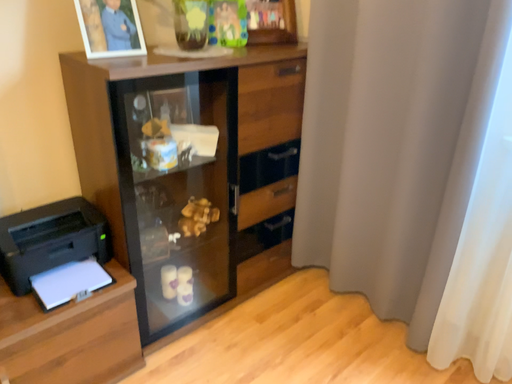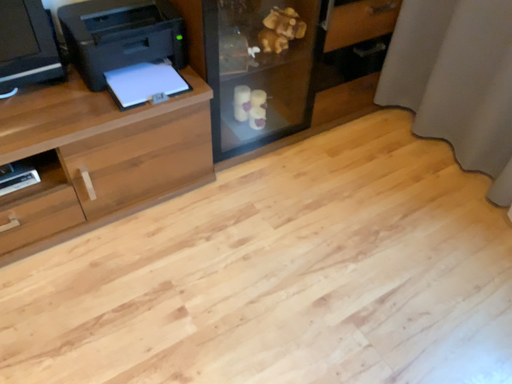
Question: How did the camera likely rotate when shooting the video?

Choices:
 (A) rotated downward
 (B) rotated upward

Answer: (A)